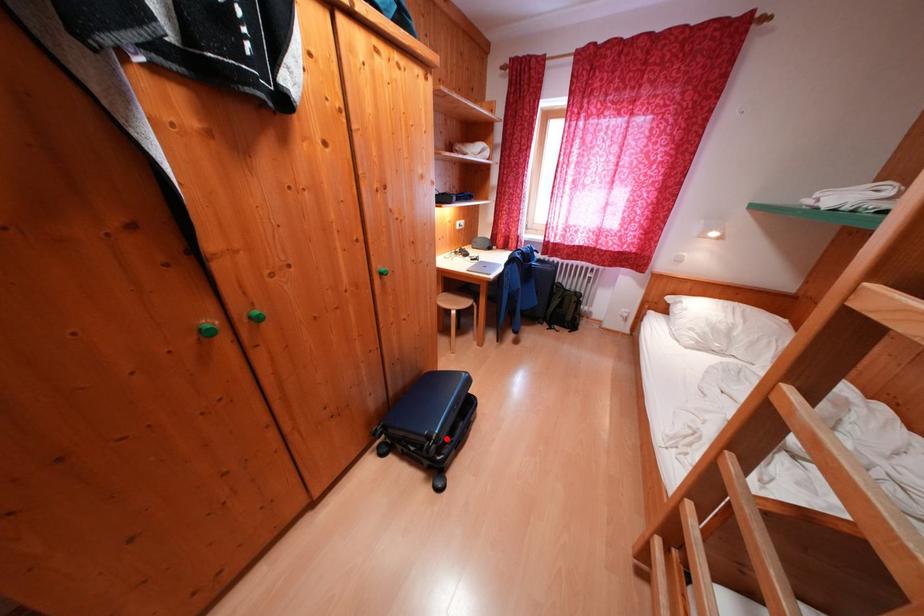
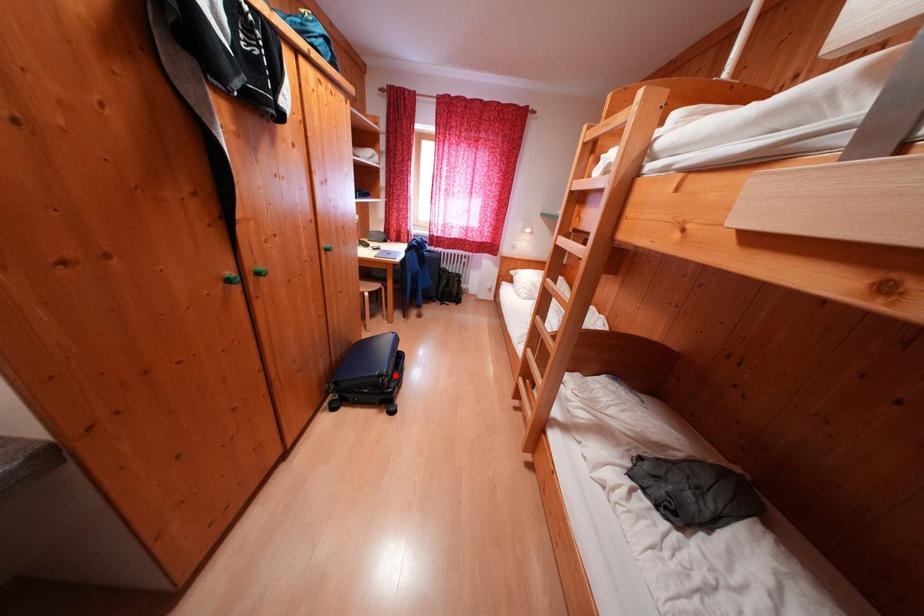
I am providing you with two images of the same scene from different viewpoints. A red point is marked on the first image and another point is marked on the second image. Is the marked point in image1 the same physical position as the marked point in image2?

Yes